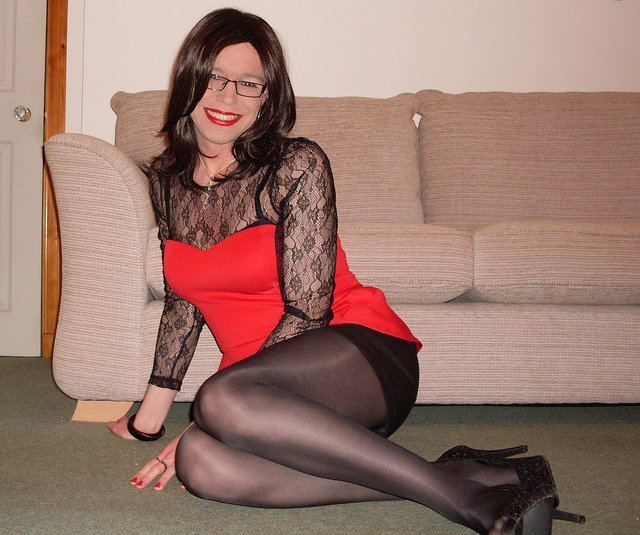
Identify the location of wall. (102, 47).